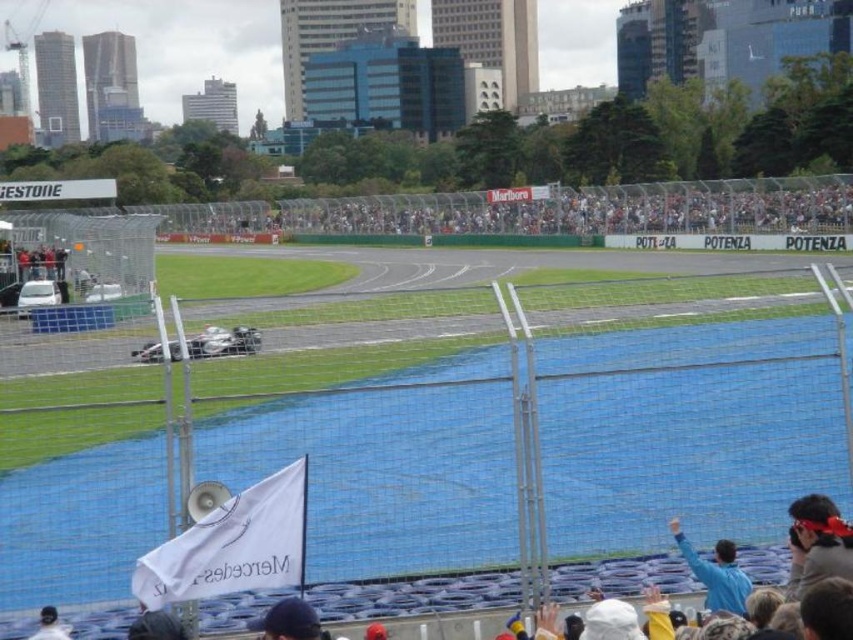
You are a photographer trying to capture a clear shot of the dark blue fabric cap at lower center without the white mesh crowd at center blocking it. What adjustment should you make to your camera angle?

Lower your camera angle so that the dark blue fabric cap at lower center is visible below the white mesh crowd at center, which is positioned above it.

You are a photographer positioned at the edge of the grandstand. You need to capture a photo of both the gray fabric cap at lower right and the white matte race car at center. Which object will appear taller in the photo?

The gray fabric cap at lower right will appear taller in the photo since it has a greater height compared to the white matte race car at center as stated in the description.

You are a photographer at the Formula One race event. You need to capture a photo of the gray fabric cap at lower right and the blue fabric at lower right. Which object should you focus on first if you want to include both in the same frame without zooming in or out?

The gray fabric cap at lower right has a larger size compared to blue fabric at lower right, so you should focus on the gray fabric cap at lower right first to ensure it fits properly in the frame before adjusting for the smaller blue fabric at lower right.